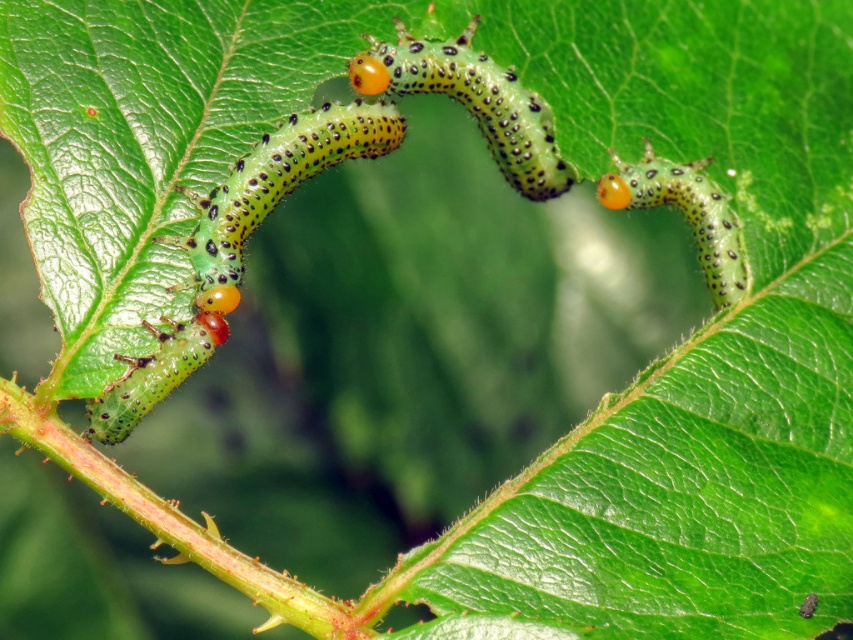
Is green spotted caterpillar at center wider than green speckled caterpillar at upper right?

Yes, green spotted caterpillar at center is wider than green speckled caterpillar at upper right.

Between point (491, 64) and point (718, 227), which one is positioned in front?

Positioned in front is point (491, 64).

Who is more distant from viewer, (451, 70) or (718, 209)?

The point (718, 209) is more distant.

Where is `green spotted caterpillar at center`? This screenshot has height=640, width=853. green spotted caterpillar at center is located at coordinates (473, 102).

In the scene shown: Is the position of green matte caterpillar at left more distant than that of green spotted caterpillar at center?

No.

The image size is (853, 640). What do you see at coordinates (236, 248) in the screenshot?
I see `green matte caterpillar at left` at bounding box center [236, 248].

Does point (228, 240) come farther from viewer compared to point (569, 166)?

No, it is not.

At what (x,y) coordinates should I click in order to perform the action: click on green matte caterpillar at left. Please return your answer as a coordinate pair (x, y). This screenshot has height=640, width=853. Looking at the image, I should click on pos(236,248).

Can you confirm if green matte caterpillar at left is positioned above green speckled caterpillar at upper right?

No.

Does green matte caterpillar at left have a larger size compared to green speckled caterpillar at upper right?

Indeed, green matte caterpillar at left has a larger size compared to green speckled caterpillar at upper right.

Is point (230, 236) positioned before point (724, 224)?

Yes, it is.

Locate an element on the screen. The height and width of the screenshot is (640, 853). green matte caterpillar at left is located at coordinates (236, 248).